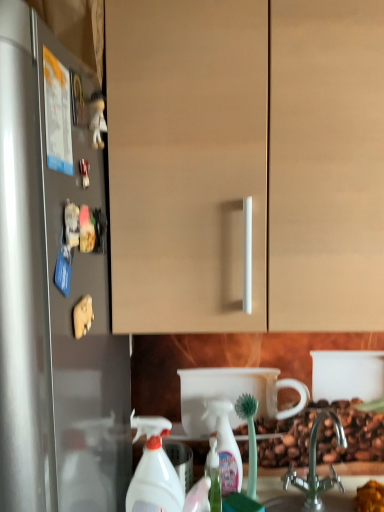
Question: Is white plastic spray bottle at lower center, which ranks as the second cleaning product in right-to-left order, oriented towards white plastic spray bottle at lower center, which is the 2th cleaning product in left-to-right order?

Choices:
 (A) no
 (B) yes

Answer: (A)

Question: Is white plastic spray bottle at lower center, arranged as the first cleaning product when viewed from the front, shorter than white plastic spray bottle at lower center, which is the 2th cleaning product in left-to-right order?

Choices:
 (A) yes
 (B) no

Answer: (B)

Question: Could white plastic spray bottle at lower center, which is the first cleaning product from back to front, be considered to be inside white plastic spray bottle at lower center, the 1th cleaning product viewed from the left?

Choices:
 (A) no
 (B) yes

Answer: (A)

Question: From a real-world perspective, is white plastic spray bottle at lower center, arranged as the first cleaning product when viewed from the front, located higher than white plastic spray bottle at lower center, the 2th cleaning product positioned from the front?

Choices:
 (A) yes
 (B) no

Answer: (A)

Question: Is white plastic spray bottle at lower center, arranged as the first cleaning product when viewed from the front, thinner than white plastic spray bottle at lower center, which appears as the first cleaning product when viewed from the right?

Choices:
 (A) yes
 (B) no

Answer: (B)

Question: Does white plastic spray bottle at lower center, the second cleaning product viewed from the back, come in front of white plastic spray bottle at lower center, which appears as the first cleaning product when viewed from the right?

Choices:
 (A) yes
 (B) no

Answer: (A)

Question: Does white plastic spray bottle at lower center, the 2th cleaning product positioned from the front, have a larger size compared to silver metallic faucet at lower center?

Choices:
 (A) no
 (B) yes

Answer: (A)

Question: From a real-world perspective, is white plastic spray bottle at lower center, which is the first cleaning product from back to front, located beneath silver metallic faucet at lower center?

Choices:
 (A) no
 (B) yes

Answer: (A)

Question: Is white plastic spray bottle at lower center, which is the 2th cleaning product in left-to-right order, wider than silver metallic faucet at lower center?

Choices:
 (A) yes
 (B) no

Answer: (B)

Question: Could you tell me if white plastic spray bottle at lower center, the 2th cleaning product positioned from the front, is facing silver metallic faucet at lower center?

Choices:
 (A) yes
 (B) no

Answer: (B)

Question: Is white plastic spray bottle at lower center, which is the 2th cleaning product in left-to-right order, far from silver metallic faucet at lower center?

Choices:
 (A) yes
 (B) no

Answer: (B)

Question: Is the position of white plastic spray bottle at lower center, which is the 2th cleaning product in left-to-right order, more distant than that of silver metallic faucet at lower center?

Choices:
 (A) no
 (B) yes

Answer: (B)

Question: Can silver metallic faucet at lower center be found inside translucent plastic soap dispenser at lower center?

Choices:
 (A) yes
 (B) no

Answer: (B)